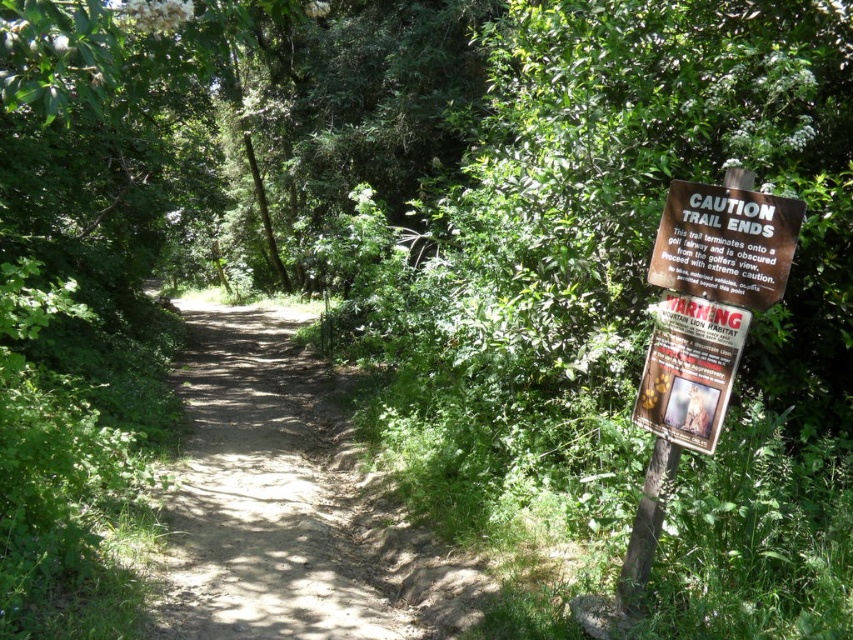
Does brown wooden sign at right have a lesser height compared to wooden sign at right?

Yes, brown wooden sign at right is shorter than wooden sign at right.

Can you confirm if brown wooden sign at right is smaller than wooden sign at right?

No, brown wooden sign at right is not smaller than wooden sign at right.

Between point (785, 211) and point (701, 310), which one is positioned in front?

Point (785, 211) is in front.

This screenshot has width=853, height=640. In order to click on brown wooden sign at right in this screenshot , I will do click(724, 243).

Can you confirm if dirt path at center is positioned below wooden sign at right?

Yes, dirt path at center is below wooden sign at right.

Is dirt path at center smaller than wooden sign at right?

No.

Identify the location of dirt path at center. (257, 499).

Can you confirm if dirt path at center is taller than brown wooden sign at right?

Yes.

Is dirt path at center wider than brown wooden sign at right?

Yes.

What do you see at coordinates (257, 499) in the screenshot? This screenshot has width=853, height=640. I see `dirt path at center` at bounding box center [257, 499].

Image resolution: width=853 pixels, height=640 pixels. What are the coordinates of `dirt path at center` in the screenshot? It's located at (257, 499).